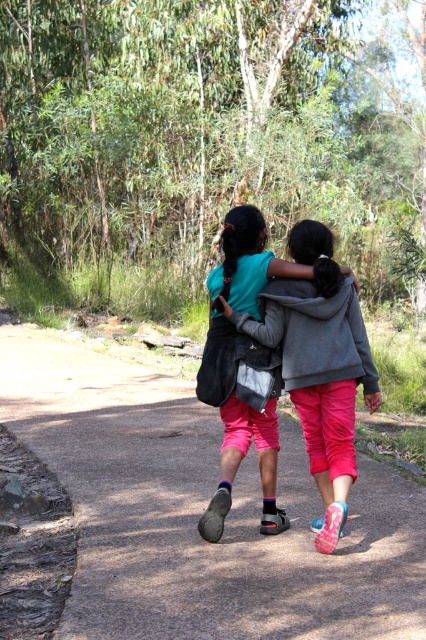
Question: Which of the following is the farthest from the observer?

Choices:
 (A) (348, 614)
 (B) (265, 296)

Answer: (B)

Question: Does dirt path at center appear on the right side of matte gray hoodie at center?

Choices:
 (A) yes
 (B) no

Answer: (B)

Question: Does dirt path at center appear on the right side of matte gray hoodie at center?

Choices:
 (A) yes
 (B) no

Answer: (B)

Question: Can you confirm if dirt path at center is positioned above matte gray hoodie at center?

Choices:
 (A) no
 (B) yes

Answer: (A)

Question: Which of the following is the farthest from the observer?

Choices:
 (A) matte gray hoodie at center
 (B) dirt path at center

Answer: (A)